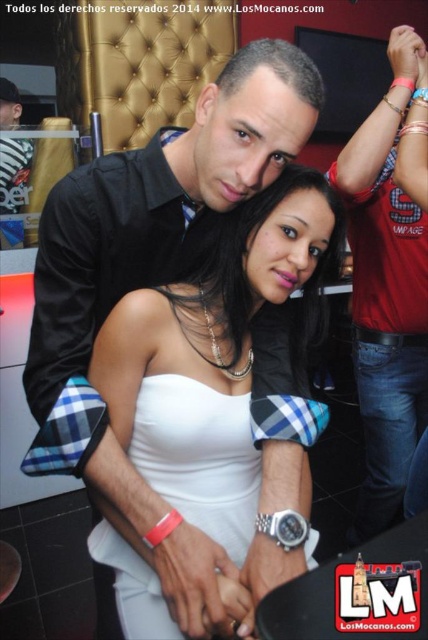
Who is taller, red plaid shirt at center or white matte dress at center?

red plaid shirt at center

Is point (357, 301) in front of point (121, 566)?

That is False.

You are a GUI agent. You are given a task and a screenshot of the screen. Output one action in this format:
    pyautogui.click(x=<x>, y=<y>)
    Task: Click on the red plaid shirt at center
    The height and width of the screenshot is (640, 428).
    Given the screenshot: What is the action you would take?
    pyautogui.click(x=386, y=292)

Between white satin dress at center and white matte dress at center, which one is positioned lower?

Positioned lower is white matte dress at center.

Can you confirm if white satin dress at center is taller than white matte dress at center?

Indeed, white satin dress at center has a greater height compared to white matte dress at center.

Who is more forward, (250, 212) or (220, 451)?

Point (250, 212)

The height and width of the screenshot is (640, 428). In order to click on white satin dress at center in this screenshot , I will do `click(219, 307)`.

Locate an element on the screen. white satin dress at center is located at coordinates (219, 307).

Identify the location of white satin dress at center. The width and height of the screenshot is (428, 640). (219, 307).